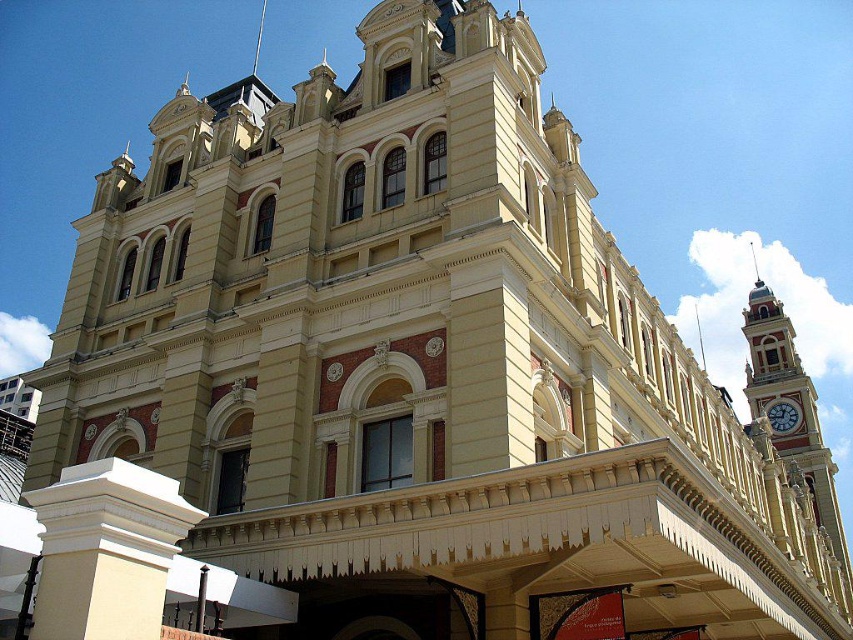
Question: Which of these objects is positioned closest to the gold-painted metal clock tower at right?

Choices:
 (A) white smooth pillar at lower left
 (B) white glossy clock at upper right

Answer: (B)

Question: Does white smooth pillar at lower left have a larger size compared to gold-painted metal clock tower at right?

Choices:
 (A) yes
 (B) no

Answer: (B)

Question: Is white smooth pillar at lower left closer to camera compared to gold-painted metal clock tower at right?

Choices:
 (A) yes
 (B) no

Answer: (A)

Question: Which object is positioned farthest from the white smooth pillar at lower left?

Choices:
 (A) gold-painted metal clock tower at right
 (B) white glossy clock at upper right

Answer: (B)

Question: Can you confirm if white smooth pillar at lower left is wider than white glossy clock at upper right?

Choices:
 (A) yes
 (B) no

Answer: (B)

Question: Among these objects, which one is farthest from the camera?

Choices:
 (A) white glossy clock at upper right
 (B) gold-painted metal clock tower at right
 (C) white smooth pillar at lower left

Answer: (A)